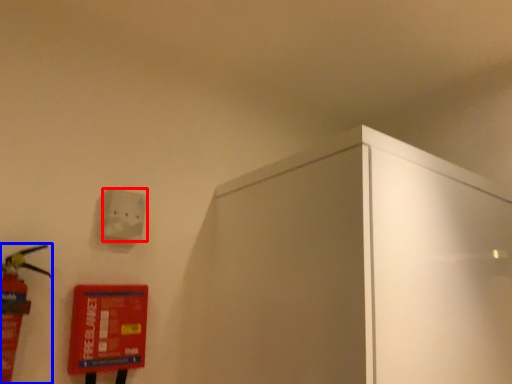
Question: Which object is closer to the camera taking this photo, light switch (highlighted by a red box) or extinguisher (highlighted by a blue box)?

Choices:
 (A) light switch
 (B) extinguisher

Answer: (B)